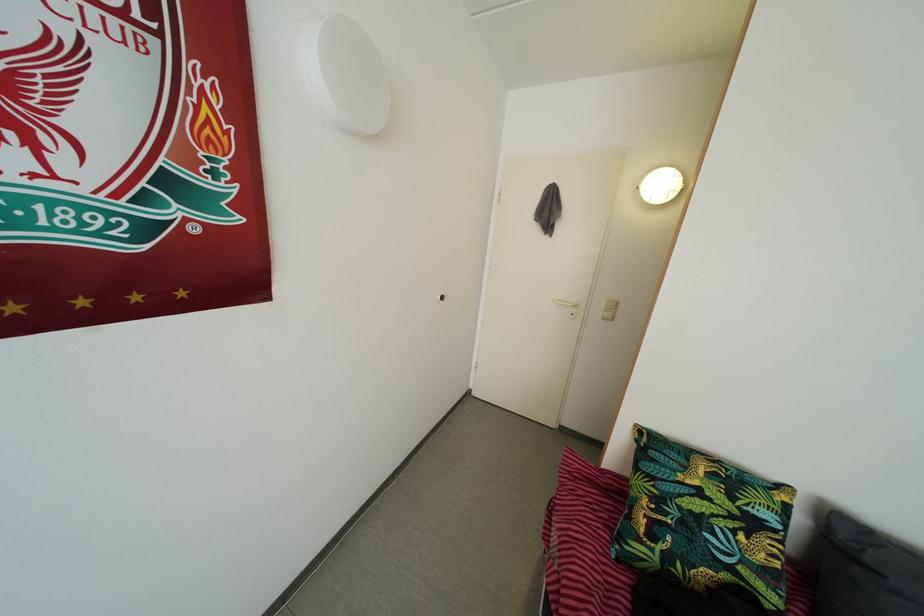
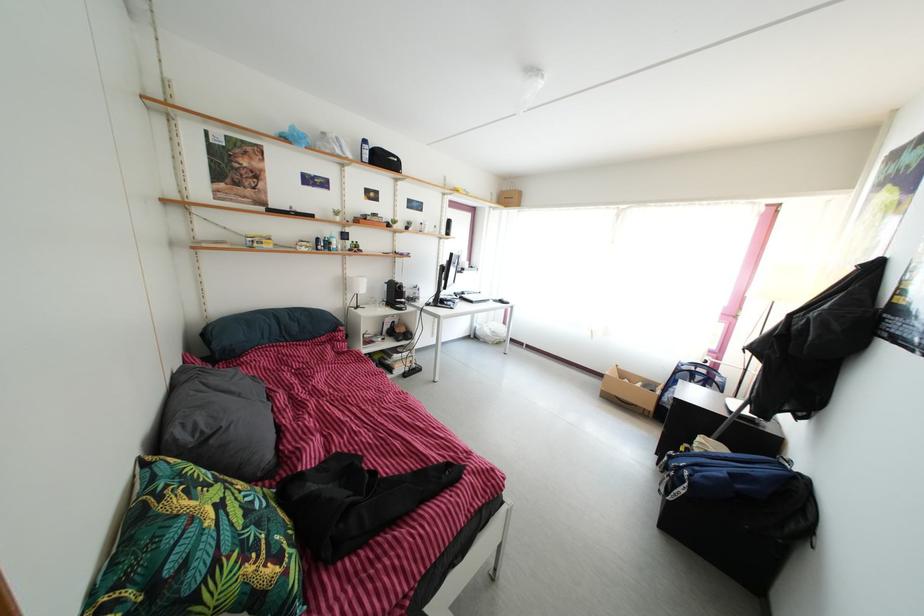
In the second image, find the point that corresponds to the point at 688,531 in the first image.

(264, 533)